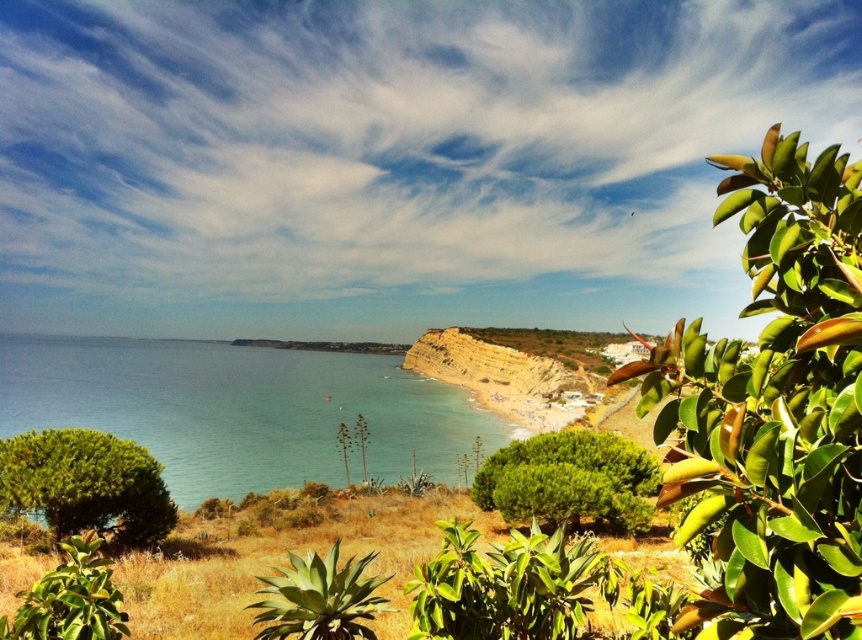
Consider the image. You are standing on the beach and want to take a photo of the blue water at center and the green glossy leaf at lower left. Which object should you focus on first if you want both to be in sharp focus?

You should focus on the green glossy leaf at lower left first because it is closer to you than the blue water at center, which is further away.

You are standing at the cliff edge and want to reach the point marked at coordinates point (x=576, y=497). The safety regulations state that you must stay at least 12 meters away from the cliff edge to avoid danger. Can you safely proceed to that point?

Answer: The distance of point (x=576, y=497) from camera is 11.39 meters, which is less than the required 12 meters. Therefore, you cannot safely proceed to that point as it is too close to the cliff edge.

You are a botanist studying plant adaptations in coastal environments. You observe the green succulent at center and the green glossy leaf at lower left. Which plant has a larger width according to the description?

The green succulent at center might be wider than green glossy leaf at lower left.